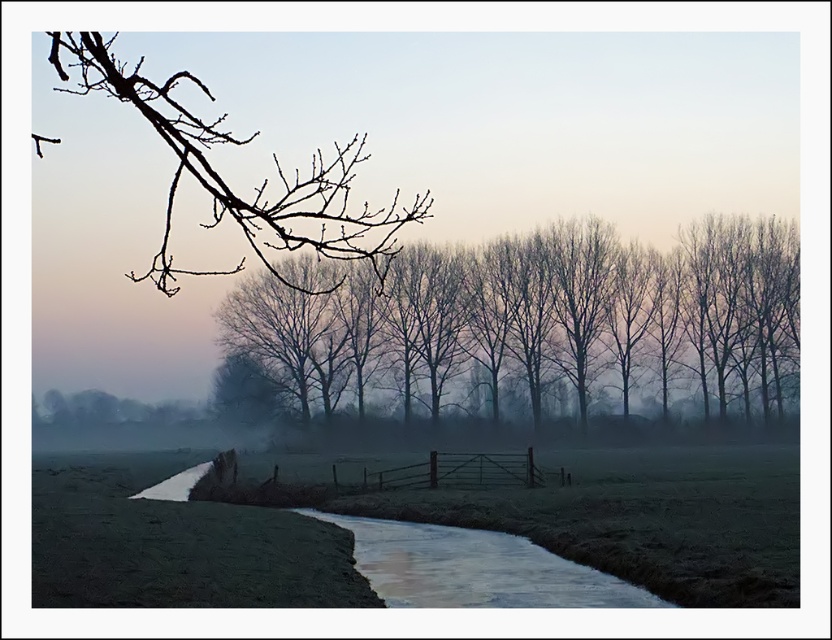
You are standing at the point labeled point (508, 310) and want to walk to point (87, 88). Which direction should you move to get closer to your destination?

To move from point (508, 310) to point (87, 88), you should move towards the lower left direction since point (508, 310) is closer to the camera than point (87, 88), indicating that point (87, 88) is further away and located in the lower left direction.